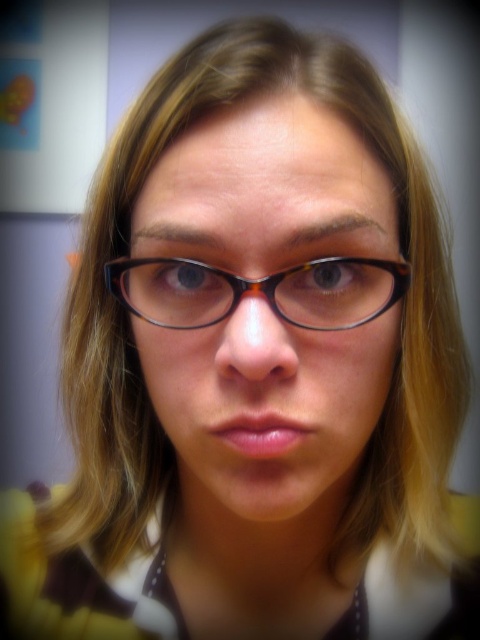
Question: Is black tortoiseshell glasses at center smaller than tortoiseshell frame glasses at center?

Choices:
 (A) no
 (B) yes

Answer: (A)

Question: Does black tortoiseshell glasses at center come behind tortoiseshell frame glasses at center?

Choices:
 (A) yes
 (B) no

Answer: (B)

Question: Can you confirm if black tortoiseshell glasses at center is positioned above tortoiseshell frame glasses at center?

Choices:
 (A) yes
 (B) no

Answer: (B)

Question: Which object is closer to the camera taking this photo?

Choices:
 (A) tortoiseshell frame glasses at center
 (B) black tortoiseshell glasses at center

Answer: (B)